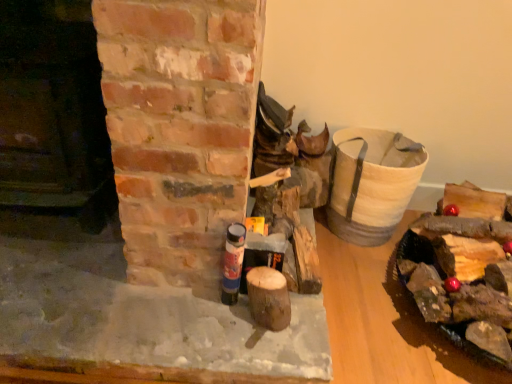
Question: Is blue matte spray can at center wider than wooden logs at right?

Choices:
 (A) yes
 (B) no

Answer: (B)

Question: Can you confirm if blue matte spray can at center is positioned to the left of wooden logs at right?

Choices:
 (A) no
 (B) yes

Answer: (B)

Question: Is blue matte spray can at center far away from wooden logs at right?

Choices:
 (A) no
 (B) yes

Answer: (A)

Question: Does blue matte spray can at center have a larger size compared to wooden logs at right?

Choices:
 (A) yes
 (B) no

Answer: (B)

Question: Are blue matte spray can at center and wooden logs at right beside each other?

Choices:
 (A) no
 (B) yes

Answer: (A)

Question: Is point (240, 228) positioned closer to the camera than point (499, 251)?

Choices:
 (A) closer
 (B) farther

Answer: (A)

Question: From the image's perspective, is blue matte spray can at center positioned above or below wooden logs at right?

Choices:
 (A) above
 (B) below

Answer: (A)

Question: Is blue matte spray can at center wider or thinner than wooden logs at right?

Choices:
 (A) thin
 (B) wide

Answer: (A)

Question: In the image, is blue matte spray can at center positioned in front of or behind wooden logs at right?

Choices:
 (A) front
 (B) behind

Answer: (B)

Question: Is smooth brick fireplace at center, which appears as the first fireplace when ordered from the bottom, spatially inside blue matte spray can at center, or outside of it?

Choices:
 (A) inside
 (B) outside

Answer: (B)

Question: Is smooth brick fireplace at center, the second fireplace in the top-to-bottom sequence, in front of or behind blue matte spray can at center in the image?

Choices:
 (A) behind
 (B) front

Answer: (B)

Question: From the image's perspective, is smooth brick fireplace at center, the second fireplace in the top-to-bottom sequence, located above or below blue matte spray can at center?

Choices:
 (A) below
 (B) above

Answer: (B)

Question: Based on their positions, is smooth brick fireplace at center, the second fireplace in the top-to-bottom sequence, located to the left or right of blue matte spray can at center?

Choices:
 (A) left
 (B) right

Answer: (A)

Question: Do you think smooth dark brown wood at left, which ranks as the 1th fireplace in top-to-bottom order, is within smooth brick fireplace at center, which appears as the first fireplace when ordered from the bottom, or outside of it?

Choices:
 (A) inside
 (B) outside

Answer: (B)

Question: Does point (19, 215) appear closer or farther from the camera than point (214, 216)?

Choices:
 (A) closer
 (B) farther

Answer: (B)